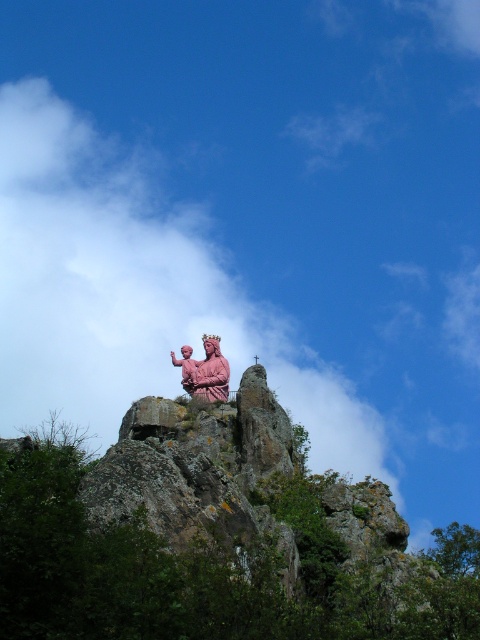
Question: Can you confirm if white fluffy cloud at upper center is wider than pink polished statue at upper center?

Choices:
 (A) yes
 (B) no

Answer: (A)

Question: Which point is closer to the camera?

Choices:
 (A) white fluffy cloud at upper center
 (B) pink matte statue at upper center
 (C) pink polished statue at upper center

Answer: (A)

Question: Is white fluffy cloud at upper center to the left of pink polished statue at upper center from the viewer's perspective?

Choices:
 (A) yes
 (B) no

Answer: (A)

Question: Which point is closer to the camera?

Choices:
 (A) pink matte statue at upper center
 (B) white fluffy cloud at upper center
 (C) pink polished statue at upper center

Answer: (B)

Question: In this image, where is white fluffy cloud at upper center located relative to pink matte statue at upper center?

Choices:
 (A) left
 (B) right

Answer: (A)

Question: Which point appears farthest from the camera in this image?

Choices:
 (A) (189, 392)
 (B) (32, 404)
 (C) (187, 358)

Answer: (B)